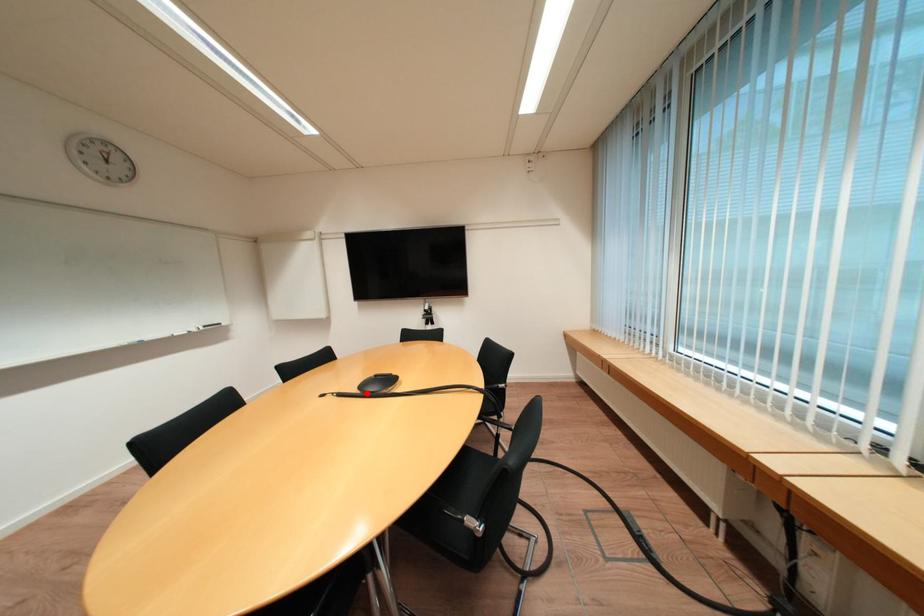
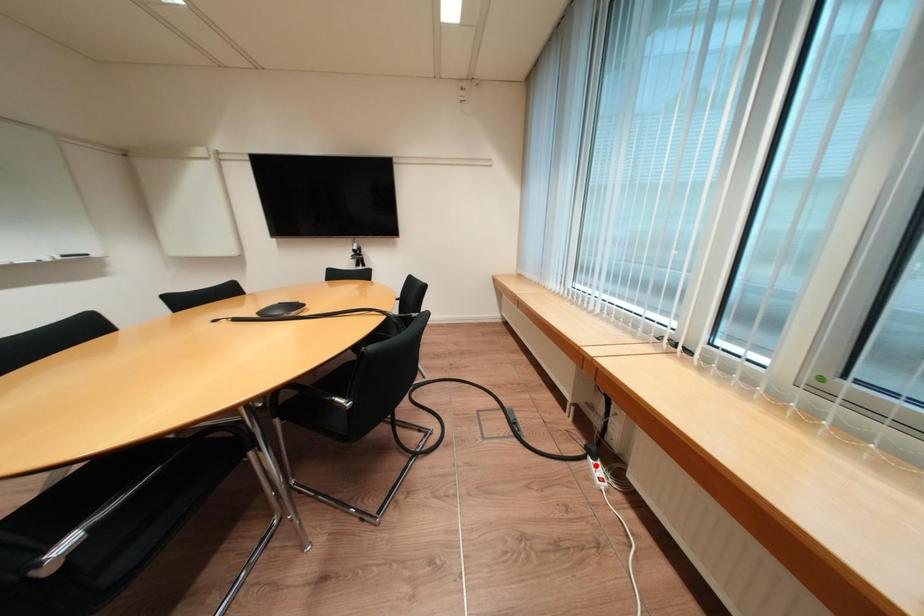
I am providing you with two images of the same scene from different viewpoints. A red point is marked on the first image and another point is marked on the second image. Are the points marked in image1 and image2 representing the same 3D position?

No